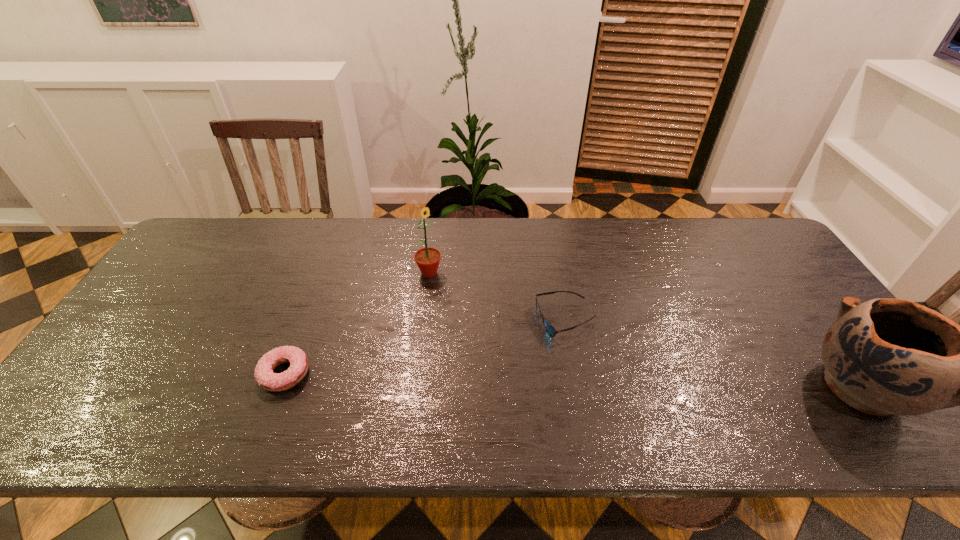
In the image, there is a desktop. Find the location of `vacant region at the near edge`. vacant region at the near edge is located at coordinates (534, 379).

This screenshot has height=540, width=960. In order to click on vacant space at the right edge of the desktop in this screenshot , I will do `click(800, 286)`.

In the image, there is a desktop. What are the coordinates of `free region at the far left corner` in the screenshot? It's located at (243, 219).

Where is `free point at the near left corner`? The image size is (960, 540). free point at the near left corner is located at coordinates [x=114, y=397].

Identify the location of free location at the far right corner. [756, 232].

Find the location of a particular element. The image size is (960, 540). vacant space in between the sunflower and the pottery is located at coordinates (645, 329).

Find the location of a particular element. Image resolution: width=960 pixels, height=540 pixels. blank region between the pottery and the third object from right to left is located at coordinates (645, 329).

Locate an element on the screen. Image resolution: width=960 pixels, height=540 pixels. free space between the sunflower and the sunglasses is located at coordinates (497, 296).

Find the location of a particular element. The height and width of the screenshot is (540, 960). free area in between the farthest object and the leftmost object is located at coordinates (357, 323).

What are the coordinates of `free space between the third object from left to right and the pottery` in the screenshot? It's located at [x=713, y=354].